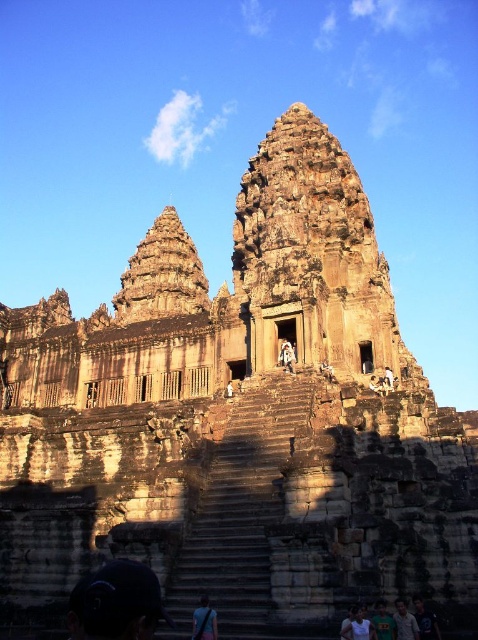
Which is behind, point (349, 630) or point (402, 602)?

Point (402, 602)

Does white cotton shirt at lower center have a smaller size compared to light blue shirt at lower right?

No.

Locate an element on the screen. The height and width of the screenshot is (640, 478). white cotton shirt at lower center is located at coordinates (357, 625).

This screenshot has height=640, width=478. What are the coordinates of `white cotton shirt at lower center` in the screenshot? It's located at (357, 625).

Can you confirm if dark blue shirt at lower right is positioned below light blue shirt at lower right?

Yes.

Can you confirm if dark blue shirt at lower right is positioned to the right of light blue shirt at lower right?

Yes, dark blue shirt at lower right is to the right of light blue shirt at lower right.

Does point (440, 637) come behind point (401, 627)?

That is True.

Locate an element on the screen. dark blue shirt at lower right is located at coordinates (424, 620).

Is brown stone stairs at center shorter than dark blue shirt at lower right?

No.

Between point (273, 452) and point (422, 627), which one is positioned in front?

Point (422, 627)

At what (x,y) coordinates should I click in order to perform the action: click on brown stone stairs at center. Please return your answer as a coordinate pair (x, y). Image resolution: width=478 pixels, height=640 pixels. Looking at the image, I should click on point(240,515).

Where is `brown stone stairs at center`? The height and width of the screenshot is (640, 478). brown stone stairs at center is located at coordinates (240, 515).